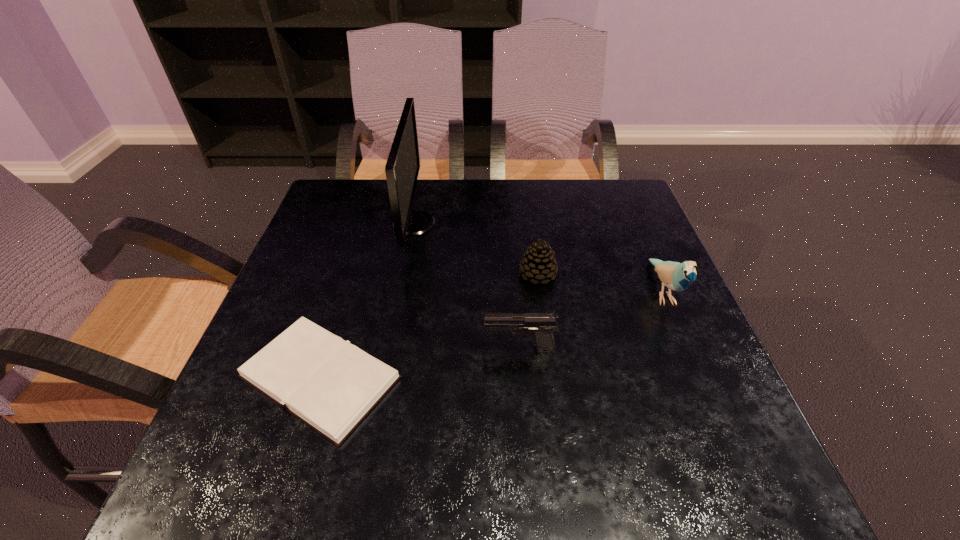
What are the coordinates of `vacant space at the far edge of the desktop` in the screenshot? It's located at (526, 222).

This screenshot has width=960, height=540. Identify the location of free point at the left edge. (354, 266).

At what (x,y) coordinates should I click in order to perform the action: click on vacant space at the right edge of the desktop. Please return your answer as a coordinate pair (x, y). The height and width of the screenshot is (540, 960). Looking at the image, I should click on pos(684,330).

This screenshot has width=960, height=540. Find the location of `vacant space at the far left corner of the desktop`. vacant space at the far left corner of the desktop is located at coordinates click(x=371, y=194).

In the image, there is a desktop. Identify the location of vacant space at the far right corner. (608, 180).

This screenshot has height=540, width=960. I want to click on vacant area at the near right corner of the desktop, so click(x=764, y=477).

The height and width of the screenshot is (540, 960). I want to click on free space that is in between the shortest object and the computer monitor, so click(367, 300).

Where is `empty location between the shortest object and the pinecone`? This screenshot has width=960, height=540. empty location between the shortest object and the pinecone is located at coordinates (429, 326).

This screenshot has height=540, width=960. Find the location of `vacant space in between the pistol and the pinecone`. vacant space in between the pistol and the pinecone is located at coordinates (529, 312).

Where is `vacant space that is in between the pinecone and the second tallest object`? The height and width of the screenshot is (540, 960). vacant space that is in between the pinecone and the second tallest object is located at coordinates (600, 283).